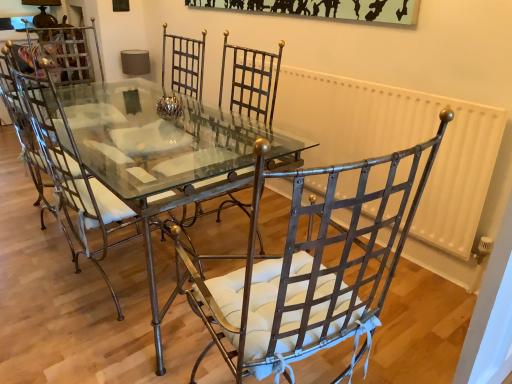
The width and height of the screenshot is (512, 384). What do you see at coordinates (400, 143) in the screenshot?
I see `white painted metal radiator at right` at bounding box center [400, 143].

Find the location of a particular element. The image size is (512, 384). metallic woven chair at center, placed as the 2th chair when sorted from left to right is located at coordinates (307, 272).

The height and width of the screenshot is (384, 512). What do you see at coordinates (69, 167) in the screenshot? I see `matte metal chair at center, acting as the 1th chair starting from the left` at bounding box center [69, 167].

This screenshot has width=512, height=384. In order to click on matte metal chair at center, which is counted as the second chair, starting from the right in this screenshot , I will do `click(69, 167)`.

This screenshot has height=384, width=512. Identify the location of white painted metal radiator at right. (400, 143).

Is white painted metal radiator at right bigger or smaller than matte metal chair at center, acting as the 1th chair starting from the left?

In the image, white painted metal radiator at right appears to be smaller than matte metal chair at center, acting as the 1th chair starting from the left.

Which is behind, point (426, 225) or point (106, 236)?

The point (426, 225) is farther from the camera.

How far apart are white painted metal radiator at right and matte metal chair at center, which is counted as the second chair, starting from the right?

They are 1.33 meters apart.

Could you tell me if white painted metal radiator at right is turned towards matte metal chair at center, which is counted as the second chair, starting from the right?

Yes, white painted metal radiator at right faces towards matte metal chair at center, which is counted as the second chair, starting from the right.

Looking at this image, is metallic glass table at center far from white painted metal radiator at right?

metallic glass table at center is near white painted metal radiator at right, not far away.

From the image's perspective, which is below, metallic glass table at center or white painted metal radiator at right?

metallic glass table at center appears lower in the image.

How many degrees apart are the facing directions of metallic glass table at center and white painted metal radiator at right?

They differ by 1.74 degrees in their facing directions.

From a real-world perspective, which object stands above the other?

white painted metal radiator at right.

Locate an element on the screen. Image resolution: width=512 pixels, height=384 pixels. radiator that is on the right side of metallic glass table at center is located at coordinates (400, 143).

Is white painted metal radiator at right closer to camera compared to metallic glass table at center?

No, white painted metal radiator at right is further to the viewer.

From a real-world perspective, who is located lower, white painted metal radiator at right or metallic glass table at center?

metallic glass table at center.

Would you say white painted metal radiator at right is to the left or to the right of metallic glass table at center in the picture?

white painted metal radiator at right is positioned on metallic glass table at center's right side.

Is point (63, 192) positioned after point (156, 134)?

No, it is in front of (156, 134).

From a real-world perspective, is matte metal chair at center, which is counted as the second chair, starting from the right, under metallic glass table at center?

No.

Is matte metal chair at center, acting as the 1th chair starting from the left, aimed at metallic glass table at center?

Yes.

Is matte metal chair at center, which is counted as the second chair, starting from the right, surrounding metallic glass table at center?

No, metallic glass table at center is not surrounded by matte metal chair at center, which is counted as the second chair, starting from the right.

Considering the relative sizes of matte metal chair at center, acting as the 1th chair starting from the left, and metallic woven chair at center, placed as the 2th chair when sorted from left to right, in the image provided, is matte metal chair at center, acting as the 1th chair starting from the left, thinner than metallic woven chair at center, placed as the 2th chair when sorted from left to right,?

No.

Does matte metal chair at center, which is counted as the second chair, starting from the right, have a larger size compared to metallic woven chair at center, placed as the 2th chair when sorted from left to right?

Yes, matte metal chair at center, which is counted as the second chair, starting from the right, is bigger than metallic woven chair at center, placed as the 2th chair when sorted from left to right.

How much distance is there between matte metal chair at center, which is counted as the second chair, starting from the right, and metallic woven chair at center, which is counted as the 1th chair, starting from the right?

They are 33.17 inches apart.

From a real-world perspective, between matte metal chair at center, which is counted as the second chair, starting from the right, and metallic woven chair at center, which is counted as the 1th chair, starting from the right, who is vertically lower?

From a 3D spatial view, metallic woven chair at center, which is counted as the 1th chair, starting from the right, is below.

Who is shorter, metallic woven chair at center, placed as the 2th chair when sorted from left to right, or matte metal chair at center, which is counted as the second chair, starting from the right?

Standing shorter between the two is matte metal chair at center, which is counted as the second chair, starting from the right.

How different are the orientations of metallic woven chair at center, which is counted as the 1th chair, starting from the right, and matte metal chair at center, which is counted as the second chair, starting from the right, in degrees?

The facing directions of metallic woven chair at center, which is counted as the 1th chair, starting from the right, and matte metal chair at center, which is counted as the second chair, starting from the right, are 16.4 degrees apart.

Is point (263, 332) positioned after point (123, 210)?

That is False.

Visually, is metallic woven chair at center, which is counted as the 1th chair, starting from the right, positioned to the left or to the right of matte metal chair at center, which is counted as the second chair, starting from the right?

Based on their positions, metallic woven chair at center, which is counted as the 1th chair, starting from the right, is located to the right of matte metal chair at center, which is counted as the second chair, starting from the right.

From a real-world perspective, is metallic glass table at center physically located above or below metallic woven chair at center, which is counted as the 1th chair, starting from the right?

metallic glass table at center is situated lower than metallic woven chair at center, which is counted as the 1th chair, starting from the right, in the real world.

Which of these two, metallic glass table at center or metallic woven chair at center, placed as the 2th chair when sorted from left to right, is bigger?

Bigger between the two is metallic glass table at center.

Is metallic glass table at center outside of metallic woven chair at center, placed as the 2th chair when sorted from left to right?

Yes.

Which is behind, point (97, 91) or point (378, 309)?

Positioned behind is point (97, 91).

Where is `radiator that is on the right side of matte metal chair at center, which is counted as the second chair, starting from the right`? radiator that is on the right side of matte metal chair at center, which is counted as the second chair, starting from the right is located at coordinates (x=400, y=143).

Locate an element on the screen. This screenshot has width=512, height=384. radiator behind the metallic glass table at center is located at coordinates (400, 143).

When comparing their distances from white painted metal radiator at right, does metallic glass table at center or metallic woven chair at center, placed as the 2th chair when sorted from left to right, seem further?

metallic woven chair at center, placed as the 2th chair when sorted from left to right, lies further to white painted metal radiator at right than the other object.

Looking at the image, which one is located closer to matte metal chair at center, acting as the 1th chair starting from the left, white painted metal radiator at right or metallic glass table at center?

Based on the image, metallic glass table at center appears to be nearer to matte metal chair at center, acting as the 1th chair starting from the left.

Considering their positions, is matte metal chair at center, acting as the 1th chair starting from the left, positioned further to metallic woven chair at center, placed as the 2th chair when sorted from left to right, than white painted metal radiator at right?

Among the two, white painted metal radiator at right is located further to metallic woven chair at center, placed as the 2th chair when sorted from left to right.

When comparing their distances from metallic glass table at center, does matte metal chair at center, acting as the 1th chair starting from the left, or metallic woven chair at center, placed as the 2th chair when sorted from left to right, seem further?

metallic woven chair at center, placed as the 2th chair when sorted from left to right.

Looking at the image, which one is located further to matte metal chair at center, which is counted as the second chair, starting from the right, metallic glass table at center or metallic woven chair at center, which is counted as the 1th chair, starting from the right?

Among the two, metallic woven chair at center, which is counted as the 1th chair, starting from the right, is located further to matte metal chair at center, which is counted as the second chair, starting from the right.

Considering their positions, is white painted metal radiator at right positioned further to matte metal chair at center, which is counted as the second chair, starting from the right, than metallic woven chair at center, placed as the 2th chair when sorted from left to right?

Among the two, white painted metal radiator at right is located further to matte metal chair at center, which is counted as the second chair, starting from the right.

Estimate the real-world distances between objects in this image. Which object is closer to white painted metal radiator at right, metallic woven chair at center, which is counted as the 1th chair, starting from the right, or matte metal chair at center, which is counted as the second chair, starting from the right?

metallic woven chair at center, which is counted as the 1th chair, starting from the right, is closer to white painted metal radiator at right.

Looking at the image, which one is located further to matte metal chair at center, acting as the 1th chair starting from the left, metallic woven chair at center, which is counted as the 1th chair, starting from the right, or white painted metal radiator at right?

Among the two, white painted metal radiator at right is located further to matte metal chair at center, acting as the 1th chair starting from the left.

Find the location of a particular element. This screenshot has height=384, width=512. chair between metallic glass table at center and white painted metal radiator at right from left to right is located at coordinates (307, 272).

At what (x,y) coordinates should I click in order to perform the action: click on chair between matte metal chair at center, which is counted as the second chair, starting from the right, and white painted metal radiator at right, in the horizontal direction. Please return your answer as a coordinate pair (x, y). This screenshot has width=512, height=384. Looking at the image, I should click on (307, 272).

In order to click on table situated between matte metal chair at center, acting as the 1th chair starting from the left, and metallic woven chair at center, which is counted as the 1th chair, starting from the right, from left to right in this screenshot , I will do `click(139, 162)`.

Image resolution: width=512 pixels, height=384 pixels. Find the location of `table situated between matte metal chair at center, which is counted as the second chair, starting from the right, and white painted metal radiator at right from left to right`. table situated between matte metal chair at center, which is counted as the second chair, starting from the right, and white painted metal radiator at right from left to right is located at coordinates (139, 162).